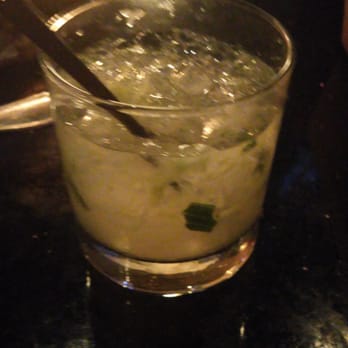
The width and height of the screenshot is (348, 348). Find the location of `glass`. glass is located at coordinates (138, 209).